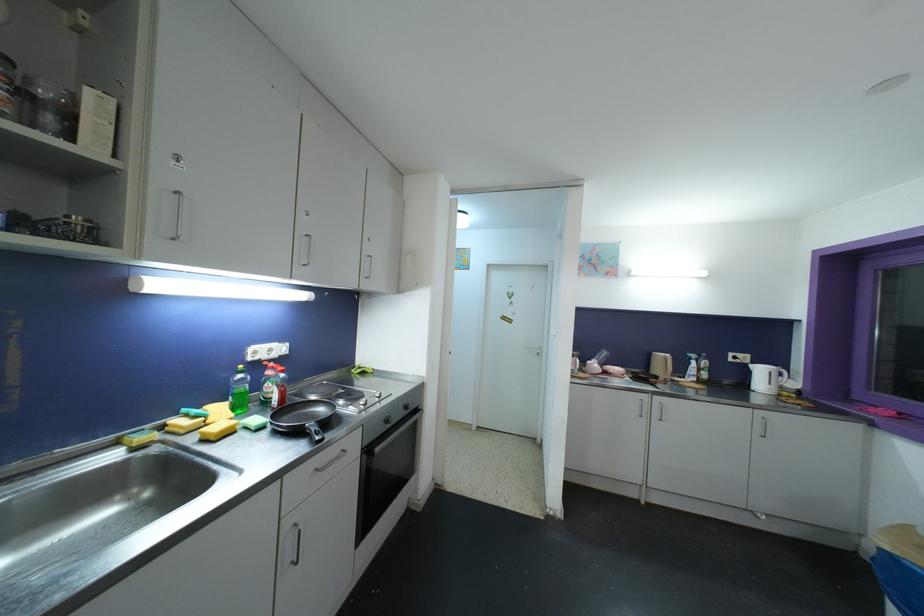
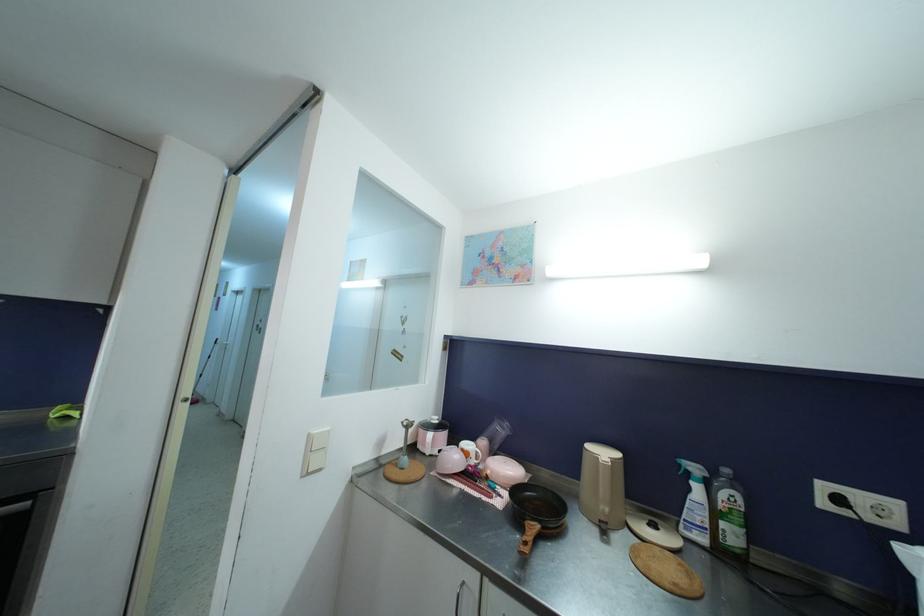
Which direction would the cameraman need to move to produce the second image?

The movement direction of the cameraman is right, forward.